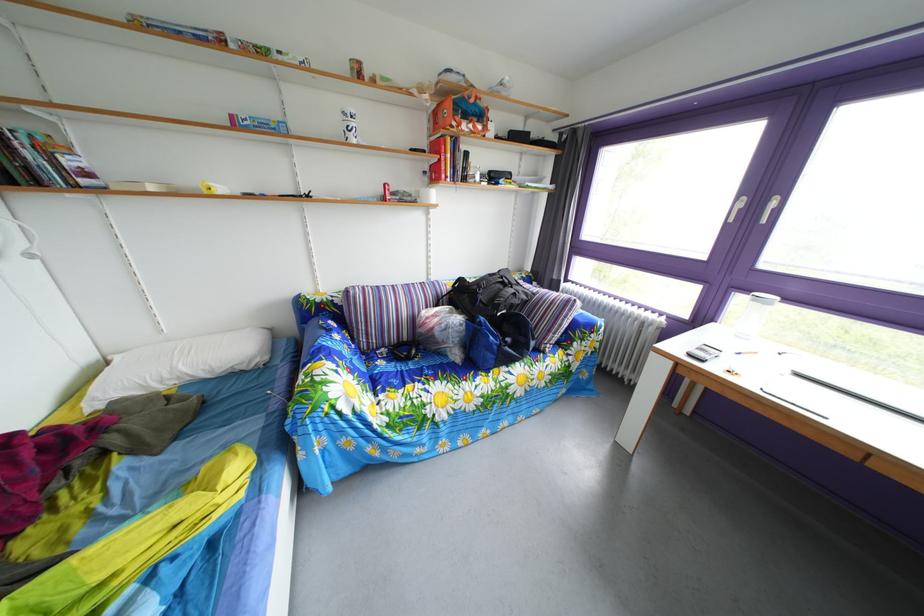
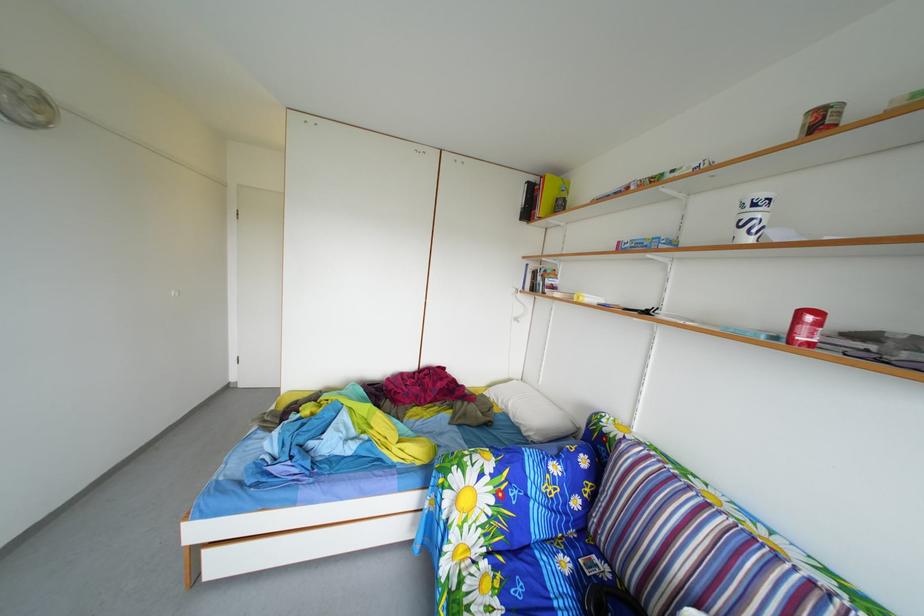
Where in the second image is the point corresponding to pixel 395 193 from the first image?

(811, 321)